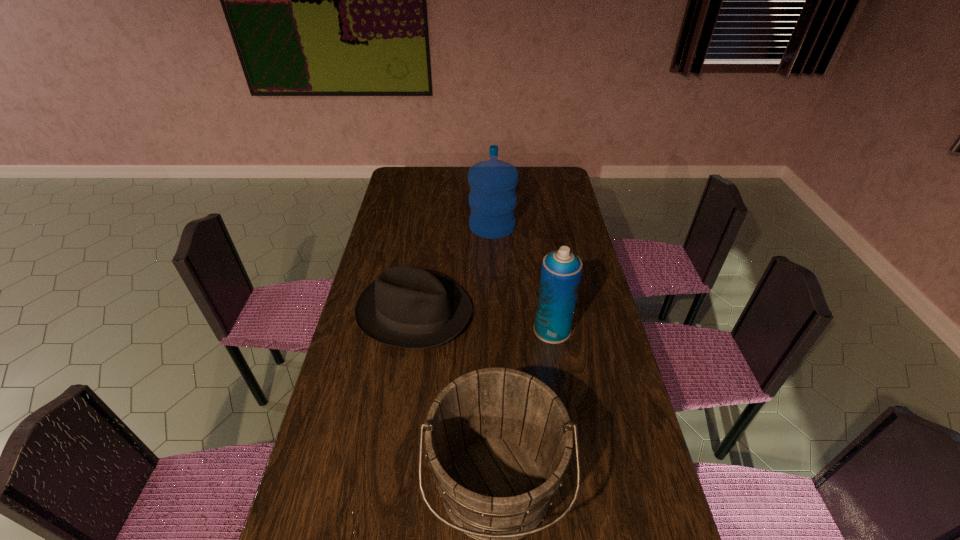
In the image, there is a desktop. Identify the location of vacant space at the right edge. The image size is (960, 540). (581, 357).

Identify the location of free space that is in between the fedora and the aerosol can. This screenshot has width=960, height=540. (483, 321).

This screenshot has height=540, width=960. I want to click on unoccupied position between the aerosol can and the fedora, so click(483, 321).

Locate an element on the screen. The image size is (960, 540). vacant space that is in between the aerosol can and the water jug is located at coordinates (522, 278).

Identify the location of free space that is in between the aerosol can and the shortest object. The width and height of the screenshot is (960, 540). (483, 321).

Where is `object that is the closest to the bucket`? object that is the closest to the bucket is located at coordinates (406, 306).

What are the coordinates of `object identified as the closest to the shortest object` in the screenshot? It's located at (561, 270).

You are a GUI agent. You are given a task and a screenshot of the screen. Output one action in this format:
    pyautogui.click(x=<x>, y=<y>)
    Task: Click on the vacant space that satisfies the following two spatial constraints: 1. on the front side of the fedora; 2. on the right side of the aerosol can
    The image size is (960, 540).
    Given the screenshot: What is the action you would take?
    pyautogui.click(x=412, y=329)